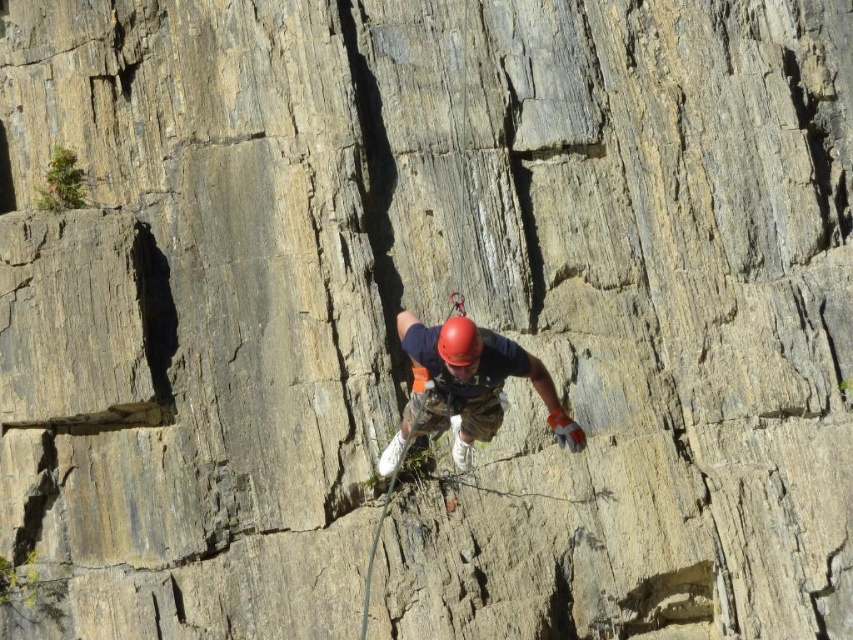
Can you confirm if matte blue shirt at center is wider than red matte helmet at center?

Indeed, matte blue shirt at center has a greater width compared to red matte helmet at center.

What are the coordinates of `matte blue shirt at center` in the screenshot? It's located at (467, 387).